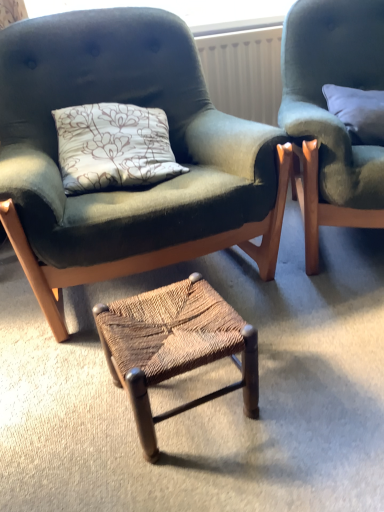
Question: Does velvet green armchair at center, acting as the first chair starting from the left, appear on the right side of woven wood stool at center?

Choices:
 (A) no
 (B) yes

Answer: (A)

Question: Is the position of velvet green armchair at center, which is the 2th chair in right-to-left order, less distant than that of woven wood stool at center?

Choices:
 (A) yes
 (B) no

Answer: (A)

Question: From a real-world perspective, does velvet green armchair at center, acting as the first chair starting from the left, sit lower than woven wood stool at center?

Choices:
 (A) yes
 (B) no

Answer: (B)

Question: Is velvet green armchair at center, which is the 2th chair in right-to-left order, wider than woven wood stool at center?

Choices:
 (A) no
 (B) yes

Answer: (B)

Question: Is velvet green armchair at center, acting as the first chair starting from the left, further to the viewer compared to woven wood stool at center?

Choices:
 (A) no
 (B) yes

Answer: (A)

Question: Considering the positions of point (375, 147) and point (213, 36), is point (375, 147) closer or farther from the camera than point (213, 36)?

Choices:
 (A) farther
 (B) closer

Answer: (B)

Question: Is velvet green chair at upper right, which is the first chair in right-to-left order, taller or shorter than white textured radiator at upper center?

Choices:
 (A) short
 (B) tall

Answer: (B)

Question: Visually, is velvet green chair at upper right, which is the first chair in right-to-left order, positioned to the left or to the right of white textured radiator at upper center?

Choices:
 (A) right
 (B) left

Answer: (A)

Question: In terms of width, does velvet green chair at upper right, which ranks as the second chair in left-to-right order, look wider or thinner when compared to white textured radiator at upper center?

Choices:
 (A) thin
 (B) wide

Answer: (B)

Question: From a real-world perspective, relative to white textured radiator at upper center, is velvet green armchair at center, which is the 2th chair in right-to-left order, vertically above or below?

Choices:
 (A) above
 (B) below

Answer: (B)

Question: In the image, is velvet green armchair at center, which is the 2th chair in right-to-left order, positioned in front of or behind white textured radiator at upper center?

Choices:
 (A) front
 (B) behind

Answer: (A)

Question: Considering the positions of point (56, 49) and point (236, 48), is point (56, 49) closer or farther from the camera than point (236, 48)?

Choices:
 (A) closer
 (B) farther

Answer: (A)

Question: Which is correct: velvet green armchair at center, acting as the first chair starting from the left, is inside white textured radiator at upper center, or outside of it?

Choices:
 (A) outside
 (B) inside

Answer: (A)

Question: Considering their positions, is velvet green armchair at center, which is the 2th chair in right-to-left order, located in front of or behind white soft pillow at upper right?

Choices:
 (A) front
 (B) behind

Answer: (A)

Question: Considering the positions of velvet green armchair at center, acting as the first chair starting from the left, and white soft pillow at upper right in the image, is velvet green armchair at center, acting as the first chair starting from the left, wider or thinner than white soft pillow at upper right?

Choices:
 (A) wide
 (B) thin

Answer: (A)